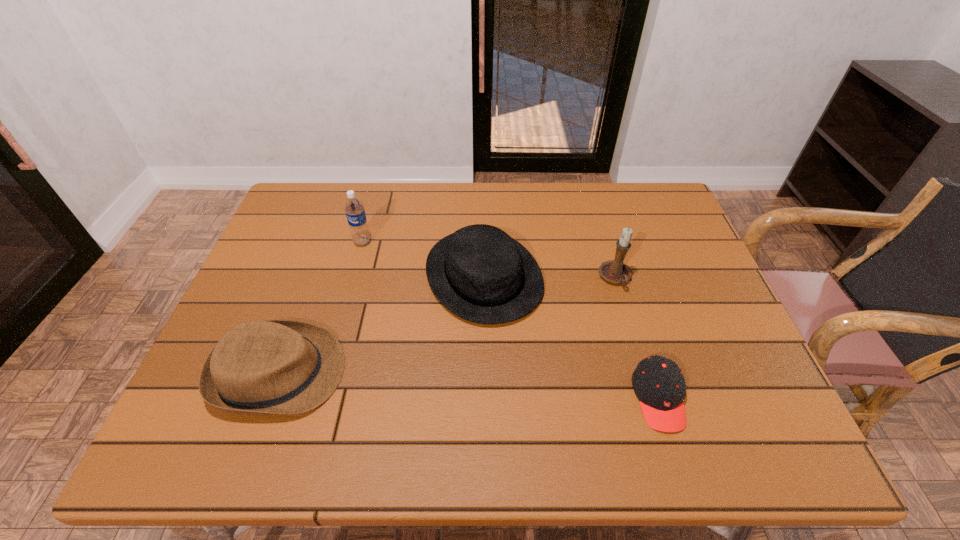
This screenshot has height=540, width=960. I want to click on fedora located at the near edge, so click(x=267, y=367).

The image size is (960, 540). Find the location of `cap that is at the near edge`. cap that is at the near edge is located at coordinates coord(658,382).

Identify the location of object that is at the left edge. This screenshot has height=540, width=960. 267,367.

This screenshot has height=540, width=960. In order to click on object positioned at the near left corner in this screenshot , I will do `click(267, 367)`.

The width and height of the screenshot is (960, 540). Identify the location of vacant space at the far edge of the desktop. (608, 218).

Locate an element on the screen. The image size is (960, 540). vacant point at the near edge is located at coordinates (408, 447).

This screenshot has width=960, height=540. I want to click on free space at the left edge of the desktop, so click(x=260, y=315).

Locate an element on the screen. The image size is (960, 540). free space at the right edge is located at coordinates (676, 274).

At what (x,y) coordinates should I click in order to perform the action: click on vacant position at the near left corner of the desktop. Please return your answer as a coordinate pair (x, y). The image size is (960, 540). Looking at the image, I should click on (239, 418).

Find the location of a particular element. Image resolution: width=960 pixels, height=540 pixels. unoccupied position between the third object from left to right and the water bottle is located at coordinates (423, 259).